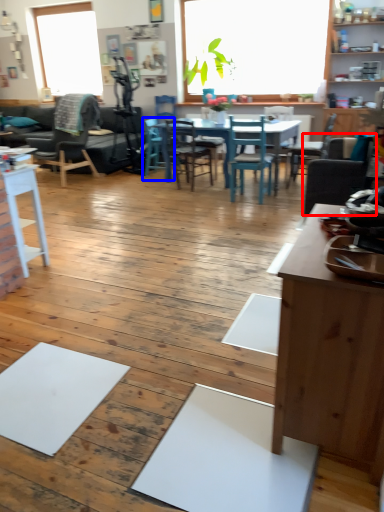
Question: Which of the following is the farthest to the observer, chair (highlighted by a red box) or chair (highlighted by a blue box)?

Choices:
 (A) chair
 (B) chair

Answer: (B)